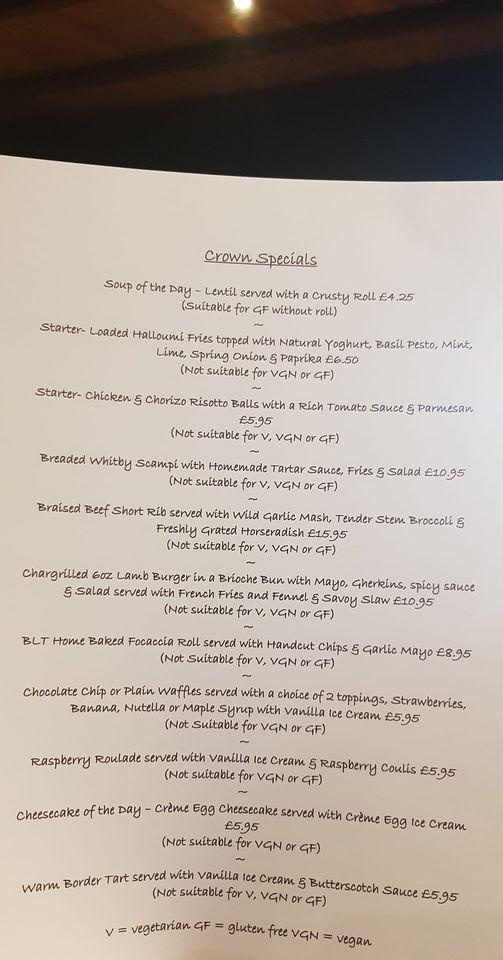
What are the coordinates of `light` in the screenshot? It's located at (245, 5).